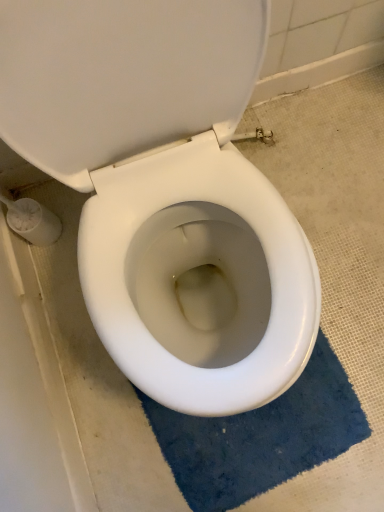
Question: From a real-world perspective, is blue plush bath mat at lower center physically above white glossy toilet seat at center?

Choices:
 (A) no
 (B) yes

Answer: (A)

Question: From a real-world perspective, is blue plush bath mat at lower center located beneath white glossy toilet seat at center?

Choices:
 (A) no
 (B) yes

Answer: (B)

Question: Does blue plush bath mat at lower center appear on the right side of white glossy toilet seat at center?

Choices:
 (A) yes
 (B) no

Answer: (A)

Question: Can you confirm if blue plush bath mat at lower center is taller than white glossy toilet seat at center?

Choices:
 (A) no
 (B) yes

Answer: (A)

Question: Considering the relative positions of blue plush bath mat at lower center and white glossy toilet seat at center in the image provided, is blue plush bath mat at lower center behind white glossy toilet seat at center?

Choices:
 (A) yes
 (B) no

Answer: (B)

Question: Would you consider blue plush bath mat at lower center to be distant from white glossy toilet seat at center?

Choices:
 (A) yes
 (B) no

Answer: (B)

Question: Is white glossy toilet seat at center directly adjacent to blue plush bath mat at lower center?

Choices:
 (A) yes
 (B) no

Answer: (B)

Question: Is white glossy toilet seat at center not close to blue plush bath mat at lower center?

Choices:
 (A) yes
 (B) no

Answer: (B)

Question: Does white glossy toilet seat at center turn towards blue plush bath mat at lower center?

Choices:
 (A) no
 (B) yes

Answer: (B)

Question: Does white glossy toilet seat at center have a lesser height compared to blue plush bath mat at lower center?

Choices:
 (A) no
 (B) yes

Answer: (A)

Question: From a real-world perspective, does white glossy toilet seat at center sit lower than blue plush bath mat at lower center?

Choices:
 (A) no
 (B) yes

Answer: (A)

Question: From a real-world perspective, does white glossy toilet seat at center stand above blue plush bath mat at lower center?

Choices:
 (A) yes
 (B) no

Answer: (A)

Question: Is point (240, 31) positioned closer to the camera than point (292, 391)?

Choices:
 (A) farther
 (B) closer

Answer: (B)